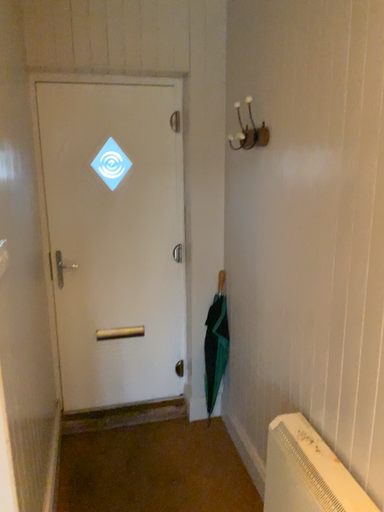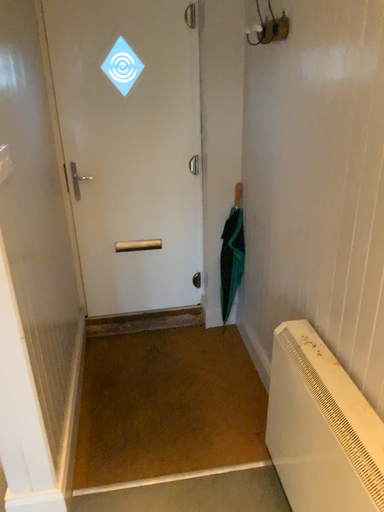
Question: Which way did the camera rotate in the video?

Choices:
 (A) rotated downward
 (B) rotated upward

Answer: (A)